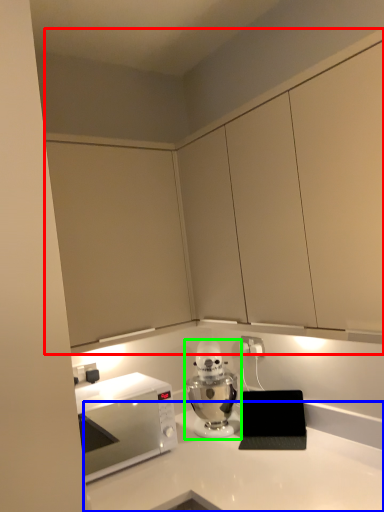
Question: Which is farther away from cabinetry (highlighted by a red box)? countertop (highlighted by a blue box) or home appliance (highlighted by a green box)?

Choices:
 (A) countertop
 (B) home appliance

Answer: (A)